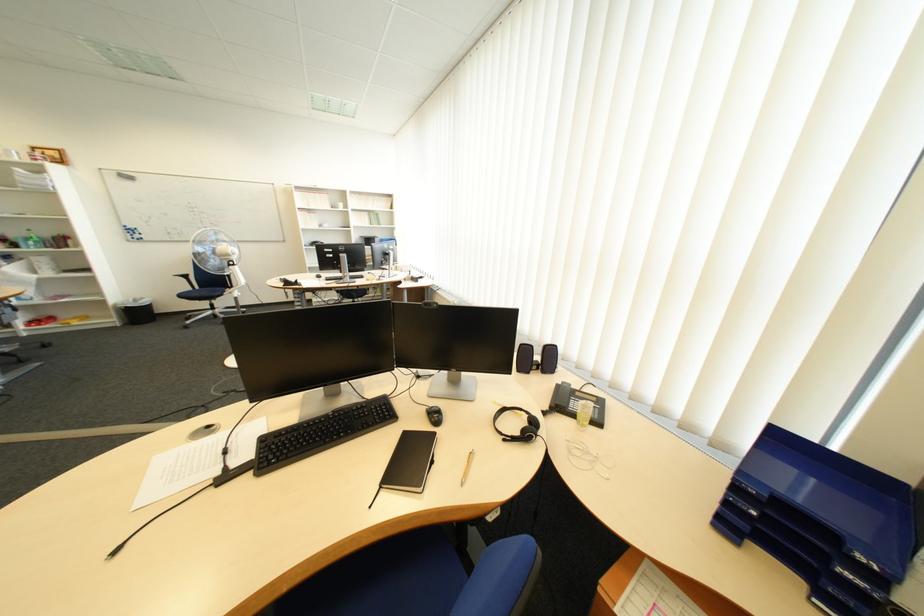
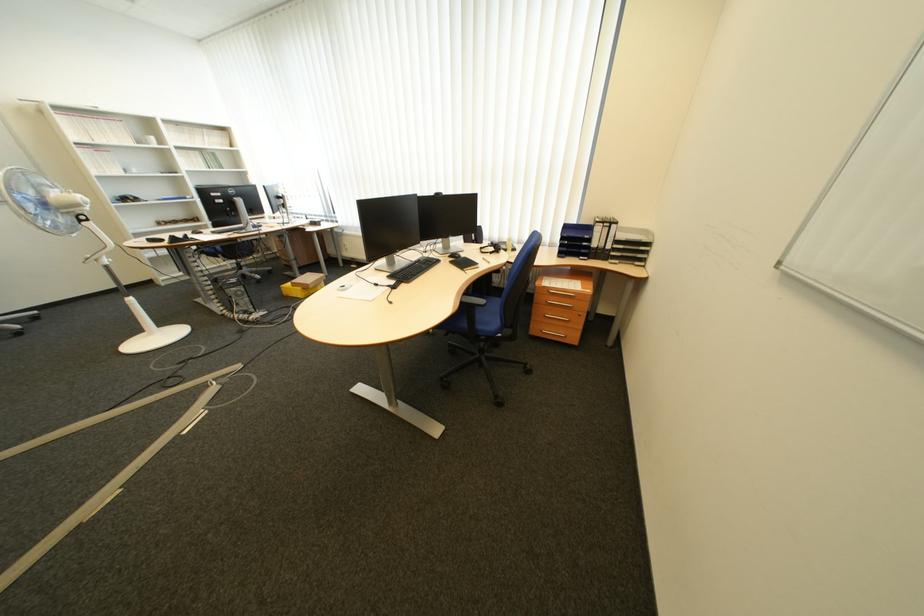
Locate, in the second image, the point that corresponds to point 368,416 in the first image.

(433, 264)